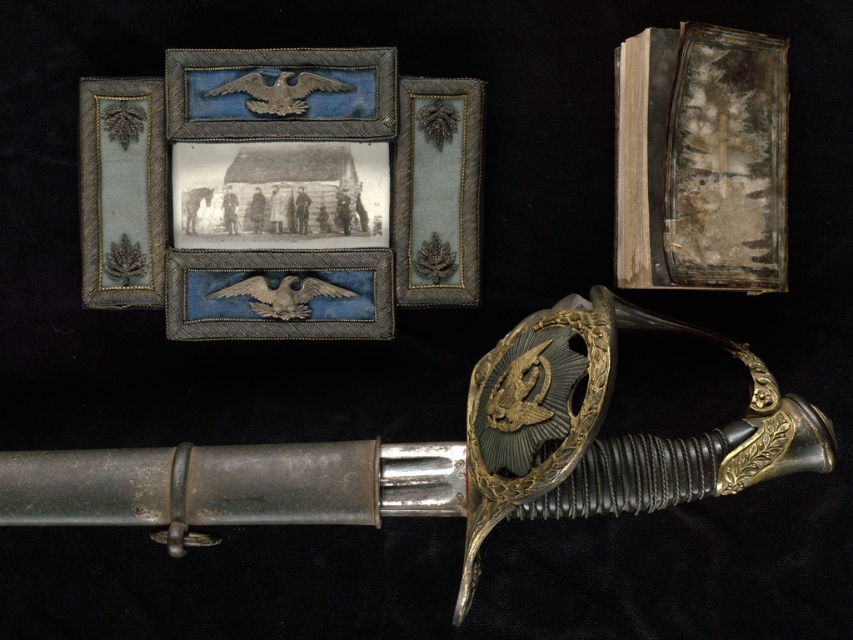
Question: Is distressed paper book at upper right positioned behind metallic/golden leaf at upper center?

Choices:
 (A) no
 (B) yes

Answer: (A)

Question: Is distressed paper book at upper right to the right of metallic/golden leaf at upper center from the viewer's perspective?

Choices:
 (A) yes
 (B) no

Answer: (A)

Question: Considering the relative positions of polished silver sword at center and matte silver eagle at center in the image provided, where is polished silver sword at center located with respect to matte silver eagle at center?

Choices:
 (A) left
 (B) right

Answer: (B)

Question: Which point is farther from the camera taking this photo?

Choices:
 (A) (213, 266)
 (B) (717, 428)
 (C) (108, 100)
 (D) (219, 120)

Answer: (A)

Question: Considering the real-world distances, which object is farthest from the distressed paper book at upper right?

Choices:
 (A) silver textured eagle at center
 (B) matte silver picture frame at upper left
 (C) matte silver eagle at center

Answer: (B)

Question: Which point is farther to the camera?

Choices:
 (A) (463, 230)
 (B) (265, 456)

Answer: (A)